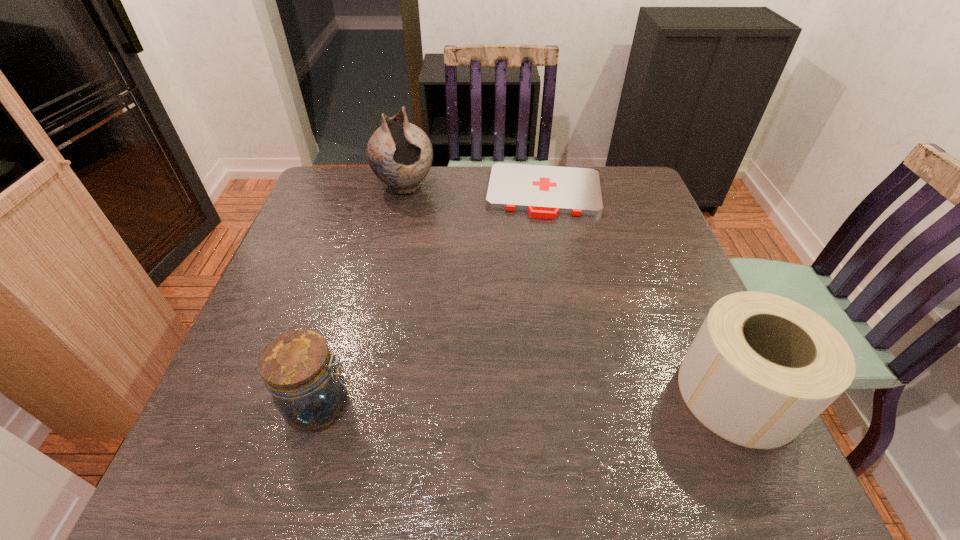
The width and height of the screenshot is (960, 540). In order to click on empty space between the jar and the shortest object in this screenshot , I will do `click(433, 299)`.

At what (x,y) coordinates should I click in order to perform the action: click on free space between the tallest object and the toilet tissue. Please return your answer as a coordinate pair (x, y). Looking at the image, I should click on (571, 290).

Image resolution: width=960 pixels, height=540 pixels. Identify the location of free area in between the second object from right to left and the jar. (433, 299).

At what (x,y) coordinates should I click in order to perform the action: click on free space between the rightmost object and the third object from left to right. Please return your answer as a coordinate pair (x, y). The height and width of the screenshot is (540, 960). Looking at the image, I should click on (641, 293).

In order to click on free space between the toilet tissue and the second object from right to left in this screenshot , I will do `click(641, 293)`.

In order to click on free space that is in between the rightmost object and the jar in this screenshot , I will do `click(530, 399)`.

The image size is (960, 540). Identify the location of empty space between the shortest object and the rightmost object. (641, 293).

This screenshot has width=960, height=540. Identify the location of free point between the pottery and the rightmost object. (571, 290).

Choose which object is the second nearest neighbor to the tallest object. Please provide its 2D coordinates. Your answer should be formatted as a tuple, i.e. [(x, y)], where the tuple contains the x and y coordinates of a point satisfying the conditions above.

[(298, 369)]

Identify which object is located as the third nearest to the toilet tissue. Please provide its 2D coordinates. Your answer should be formatted as a tuple, i.e. [(x, y)], where the tuple contains the x and y coordinates of a point satisfying the conditions above.

[(400, 154)]